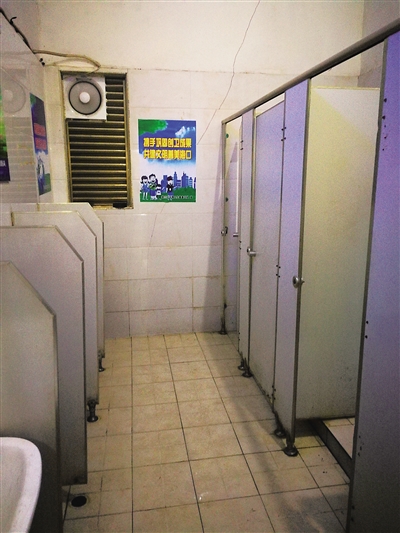
I want to click on handle, so click(x=250, y=252), click(x=304, y=281), click(x=227, y=230).